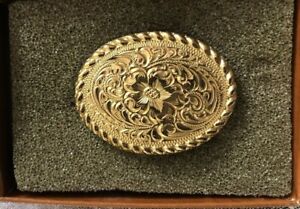
The width and height of the screenshot is (300, 209). I want to click on indented part of rug, so click(263, 67).